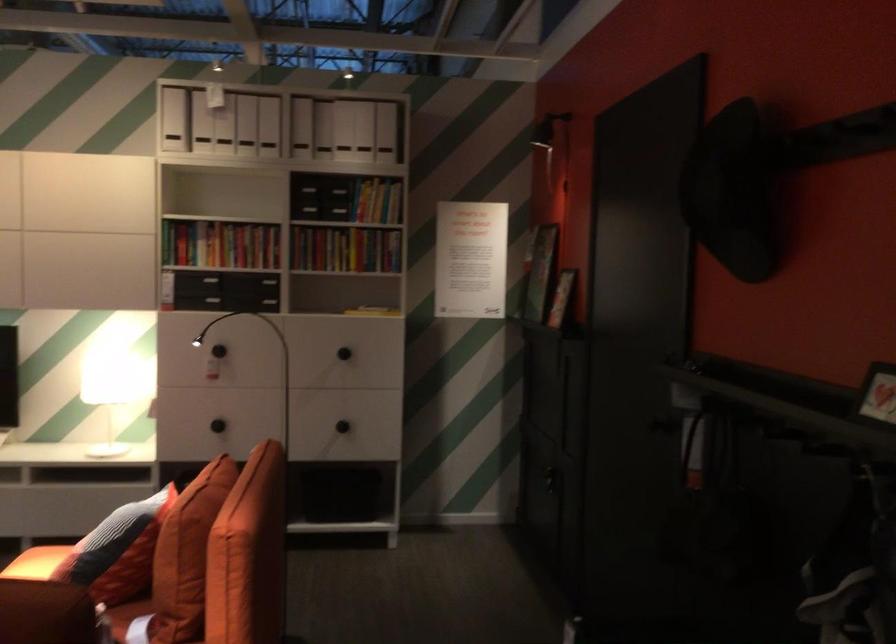
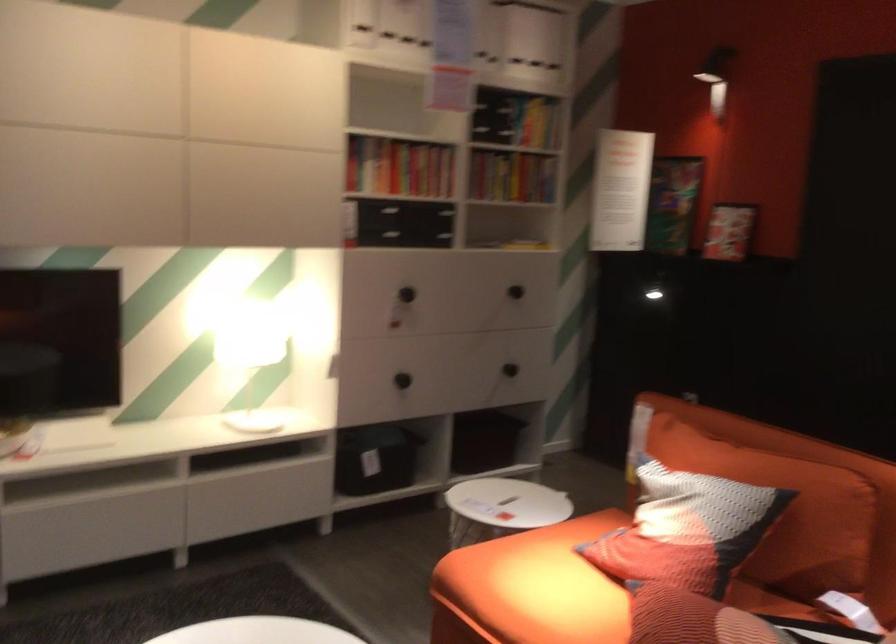
The point at (197, 428) is marked in the first image. Where is the corresponding point in the second image?

(401, 380)